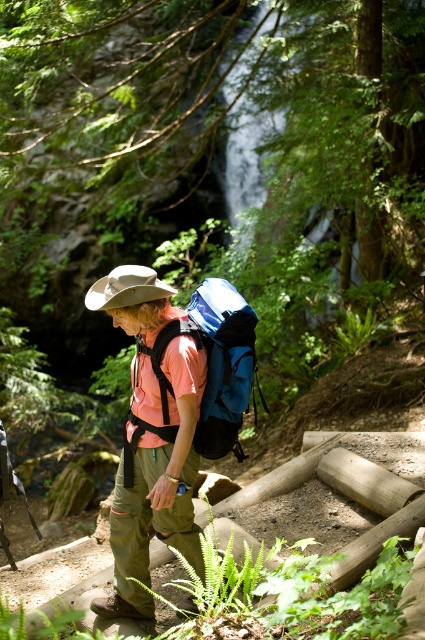
Between blue fabric backpack at center and tan fabric hat at center, which one is positioned higher?

tan fabric hat at center

Can you confirm if blue fabric backpack at center is wider than tan fabric hat at center?

Yes, blue fabric backpack at center is wider than tan fabric hat at center.

Is point (139, 426) positioned before point (104, 276)?

That is True.

At what (x,y) coordinates should I click in order to perform the action: click on blue fabric backpack at center. Please return your answer as a coordinate pair (x, y). The width and height of the screenshot is (425, 640). Looking at the image, I should click on (209, 369).

Which is below, matte pink shirt at center or blue fabric backpack at center?

matte pink shirt at center is below.

Between matte pink shirt at center and blue fabric backpack at center, which one is positioned higher?

blue fabric backpack at center

Which is in front, point (173, 410) or point (238, 365)?

Point (173, 410) is more forward.

The width and height of the screenshot is (425, 640). Identify the location of matte pink shirt at center. (155, 476).

From the picture: Is matte pink shirt at center shorter than tan fabric hat at center?

No.

Who is more forward, (138, 317) or (99, 280)?

Point (138, 317) is in front.

Where is `matte pink shirt at center`? matte pink shirt at center is located at coordinates (155, 476).

The image size is (425, 640). In order to click on matte pink shirt at center in this screenshot , I will do `click(155, 476)`.